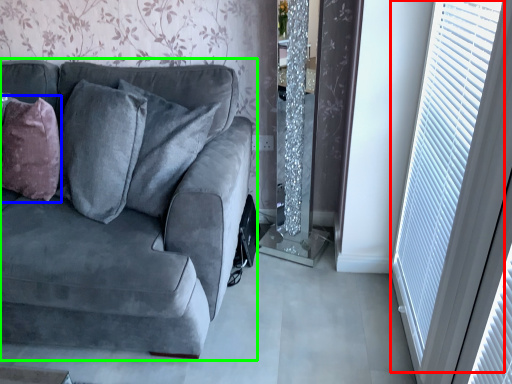
Question: Estimate the real-world distances between objects in this image. Which object is farther from window (highlighted by a red box), throw pillow (highlighted by a blue box) or studio couch (highlighted by a green box)?

Choices:
 (A) throw pillow
 (B) studio couch

Answer: (A)